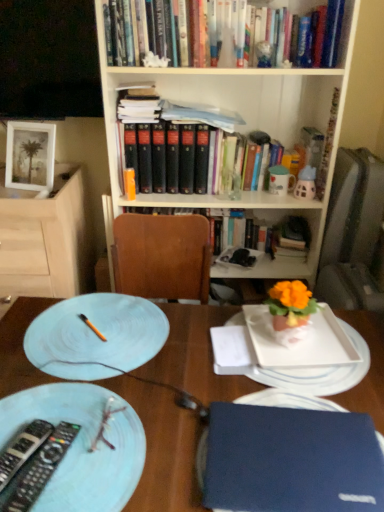
Find the location of `free point above blue matte laptop at lower right (from a real-world perspective)`. free point above blue matte laptop at lower right (from a real-world perspective) is located at coordinates (206, 389).